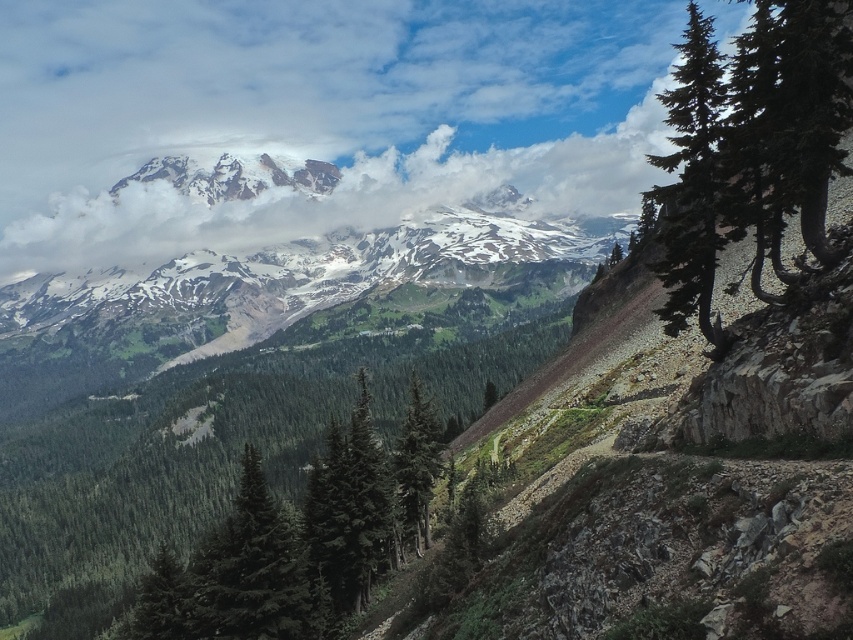
Does green rough bark tree at upper right have a lesser width compared to green matte tree at center?

No.

Does point (820, 99) come in front of point (410, 392)?

Yes, it is in front of point (410, 392).

Locate an element on the screen. green rough bark tree at upper right is located at coordinates (752, 147).

Who is higher up, snowy rocky mountain range at upper center or green matte tree at center?

snowy rocky mountain range at upper center

Does point (527, 198) come in front of point (422, 426)?

No.

Between point (514, 260) and point (419, 460), which one is positioned in front?

Point (419, 460) is more forward.

The width and height of the screenshot is (853, 640). What are the coordinates of `snowy rocky mountain range at upper center` in the screenshot? It's located at (291, 276).

Who is more forward, [686,168] or [437,470]?

Point [686,168] is more forward.

Can you confirm if green textured tree at right is positioned to the right of green matte tree at center?

Yes, green textured tree at right is to the right of green matte tree at center.

Is point (665, 252) positioned behind point (416, 429)?

Yes, point (665, 252) is behind point (416, 429).

Identify the location of green textured tree at right. (692, 182).